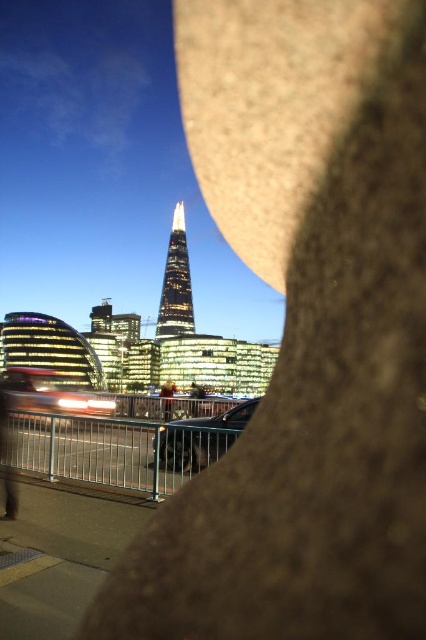
Question: Which of the following is the farthest from the observer?

Choices:
 (A) glassy reflective tower at center
 (B) light brown leather jacket at center

Answer: (A)

Question: Can you confirm if glassy reflective tower at center is bigger than light brown leather jacket at center?

Choices:
 (A) yes
 (B) no

Answer: (A)

Question: Can you confirm if glassy reflective tower at center is thinner than light brown leather jacket at center?

Choices:
 (A) no
 (B) yes

Answer: (A)

Question: Can you confirm if glassy reflective tower at center is thinner than light brown leather jacket at center?

Choices:
 (A) no
 (B) yes

Answer: (A)

Question: Which object appears closest to the camera in this image?

Choices:
 (A) light brown leather jacket at center
 (B) glassy reflective tower at center

Answer: (A)